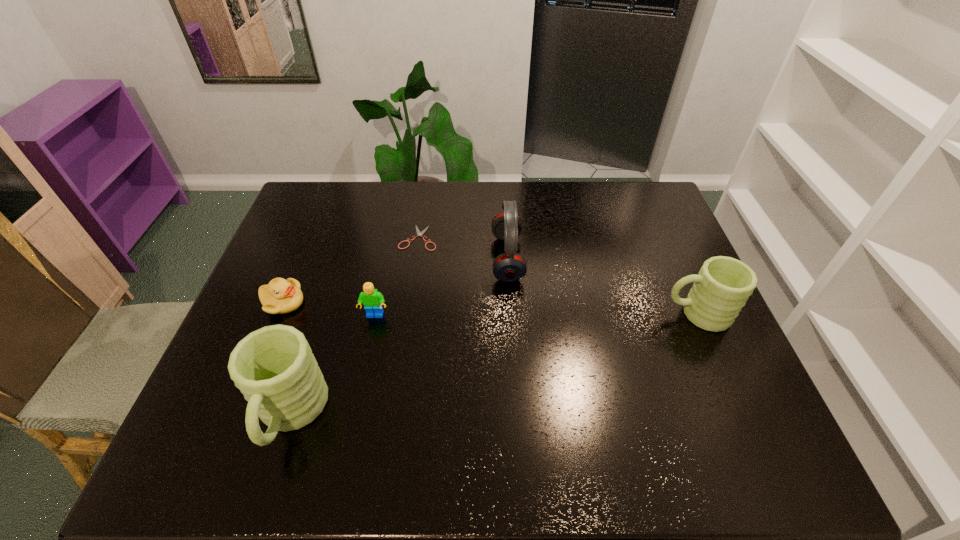
In order to click on the nearest object in this screenshot , I will do `click(274, 367)`.

Where is `the nearer mug`? This screenshot has width=960, height=540. the nearer mug is located at coordinates (274, 367).

Where is `the fourth shortest object`? the fourth shortest object is located at coordinates (720, 290).

The height and width of the screenshot is (540, 960). What are the coordinates of `the farther mug` in the screenshot? It's located at (720, 290).

You are a GUI agent. You are given a task and a screenshot of the screen. Output one action in this format:
    pyautogui.click(x=<x>, y=<y>)
    Task: Click on the earphone
    
    Given the screenshot: What is the action you would take?
    pyautogui.click(x=508, y=267)

Identify the location of shears. The image size is (960, 540). [419, 233].

You are a GUI agent. You are given a task and a screenshot of the screen. Output one action in this format:
    pyautogui.click(x=<x>, y=<y>)
    Task: Click on the duckling
    This screenshot has height=540, width=960.
    Given the screenshot: What is the action you would take?
    pyautogui.click(x=280, y=296)

Where is `Lego`? Image resolution: width=960 pixels, height=540 pixels. Lego is located at coordinates (372, 300).

Identify the location of free space located on the side of the shorter mug with the handle. (588, 314).

Image resolution: width=960 pixels, height=540 pixels. I want to click on blank area located on the side of the shorter mug with the handle, so click(588, 314).